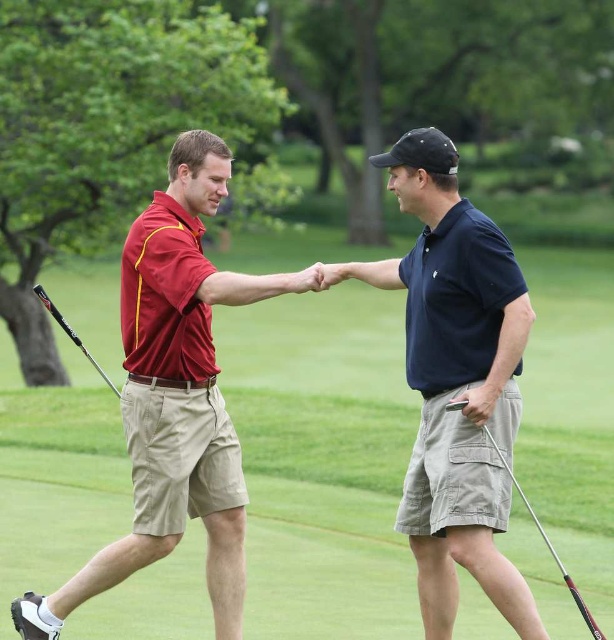
You are a photographer positioned at the edge of the golf course. You want to capture a photo that includes both the navy blue shirt at center and the metallic silver golf club at lower right. Based on their positions, which object should you adjust your camera angle to focus on first to ensure both are in frame?

Since the navy blue shirt at center is to the left of the metallic silver golf club at lower right, you should first focus on the navy blue shirt at center to ensure it stays within the frame while adjusting the angle to include the metallic silver golf club at lower right.

You are a golfer standing at the tee box and see the navy blue shirt at center at point (454, 380). Where should you aim your shot to ensure it lands near the navy blue shirt at center?

You should aim your shot towards the point (454, 380) where the navy blue shirt at center is located to ensure it lands near that area.